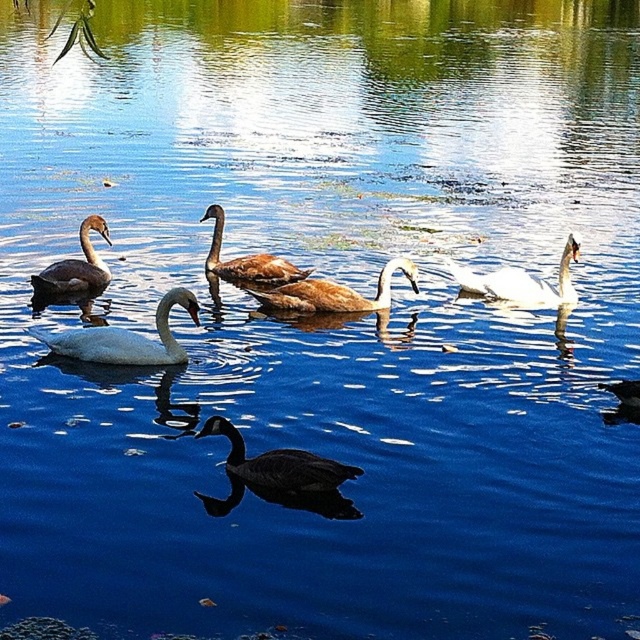
Question: Which object is the closest to the brown matte swan at center?

Choices:
 (A) dark gray matte duck at center
 (B) white glossy swan at right
 (C) brown matte swan at left

Answer: (B)

Question: Can you confirm if white glossy swan at center is wider than brown feathered swan at center?

Choices:
 (A) no
 (B) yes

Answer: (B)

Question: Among these objects, which one is farthest from the camera?

Choices:
 (A) white glossy swan at center
 (B) white glossy swan at right
 (C) brown feathered swan at center

Answer: (C)

Question: Does brown matte swan at left have a larger size compared to brown feathered swan at center?

Choices:
 (A) no
 (B) yes

Answer: (A)

Question: Which of the following is the farthest from the observer?

Choices:
 (A) (51, 337)
 (B) (320, 280)

Answer: (B)

Question: Is brown matte swan at center bigger than brown feathered swan at center?

Choices:
 (A) yes
 (B) no

Answer: (B)